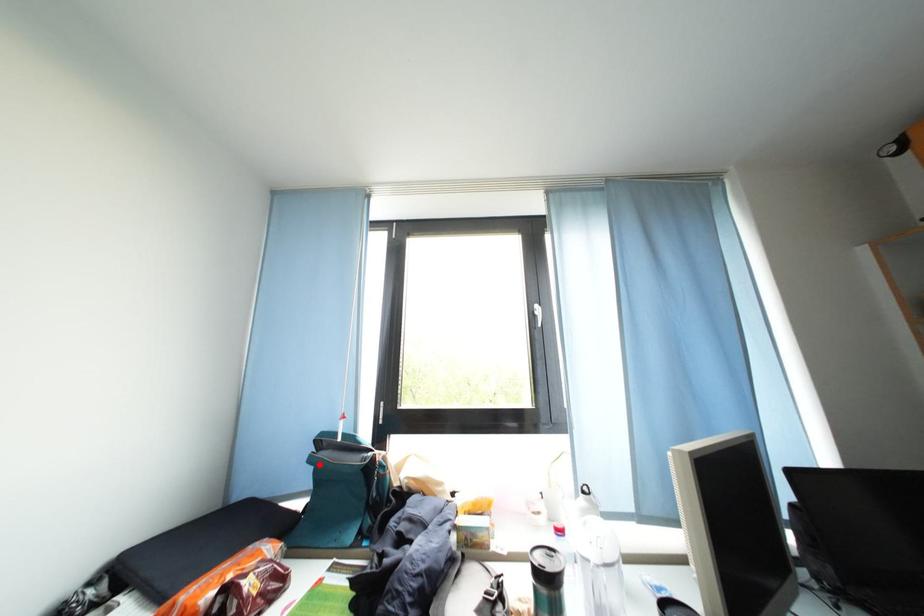
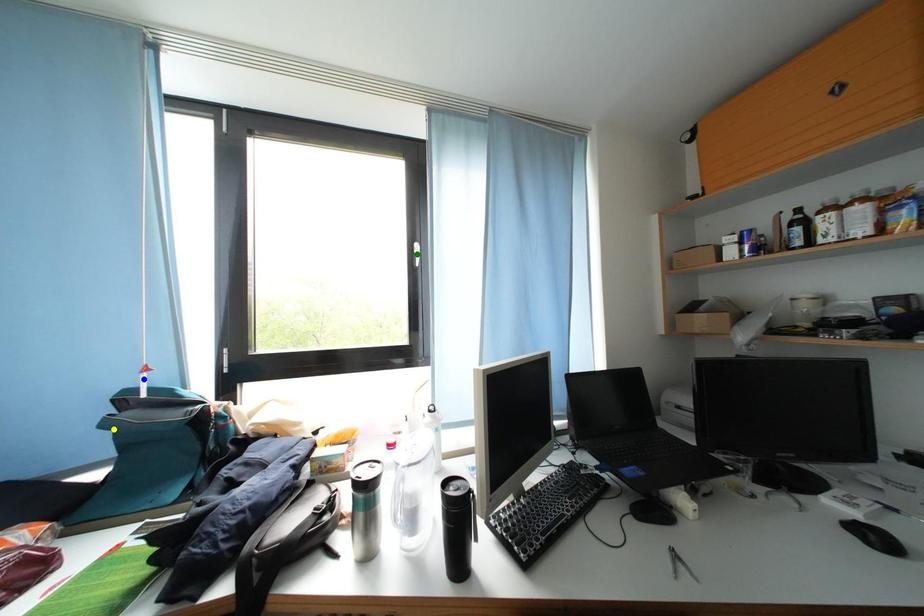
Question: I am providing you with two images of the same scene from different viewpoints. A red point is marked on the first image. You are given multiple points on the second image. Which spot in image 2 lines up with the point in image 1?

Choices:
 (A) yellow point
 (B) blue point
 (C) green point

Answer: (A)